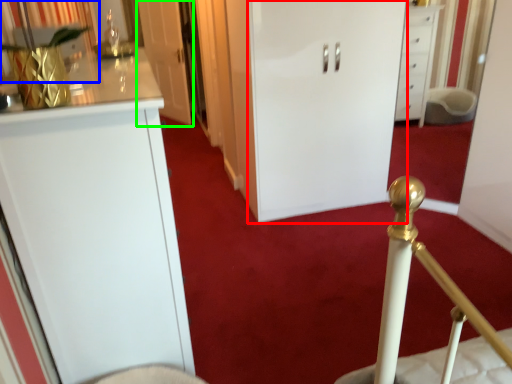
Question: Which is nearer to the door (highlighted by a red box)? curtain (highlighted by a blue box) or door (highlighted by a green box).

Choices:
 (A) curtain
 (B) door

Answer: (A)